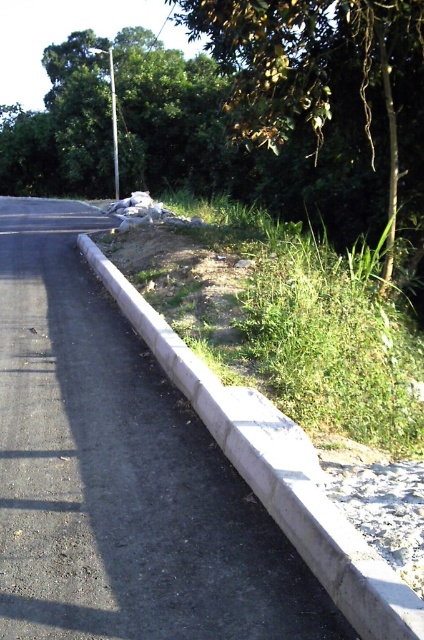
You are a delivery driver who needs to park your truck near the gray concrete curb at center without blocking the green leafy tree at upper center. Based on their heights, can your truck be parked there safely?

The green leafy tree at upper center is taller than the gray concrete curb at center. Since the truck needs to park near the curb without blocking the tree, the truck should be parked in a way that doesn not obstruct the tree. However, the height difference between the tree and curb doesn affect the parking space availability. The truck can be parked near the gray concrete curb at center as long as it doesn not block the tree physically.

You are a delivery driver who needs to park your vehicle along the gray concrete curb at center. The parking space requires the curb to be at least as wide as the metallic pole at upper center. Can you park here?

The gray concrete curb at center is narrower than the metallic pole at upper center, so it does not meet the parking space requirement. You cannot park here.

You are a delivery driver who needs to park your vehicle near the green leafy tree at upper center. The parking spot must be within 1 meter of the tree. Given that the coordinates of the tree are at point 0.161, 0.776, can you determine if the parking spot is within the required distance?

The green leafy tree at upper center is located at coordinates (329, 102). Since the parking spot must be within 1 meter of the tree, the driver must ensure their vehicle is parked within that distance from the specified coordinates.